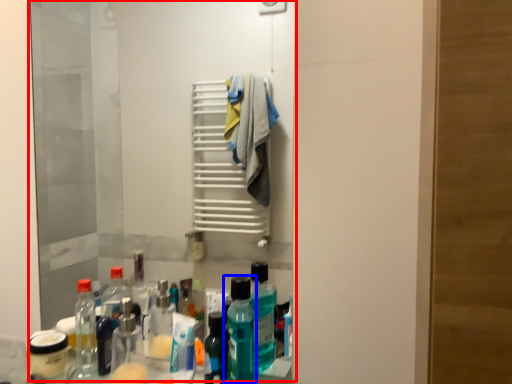
Question: Which object is closer to the camera taking this photo, mirror (highlighted by a red box) or bottle (highlighted by a blue box)?

Choices:
 (A) mirror
 (B) bottle

Answer: (B)